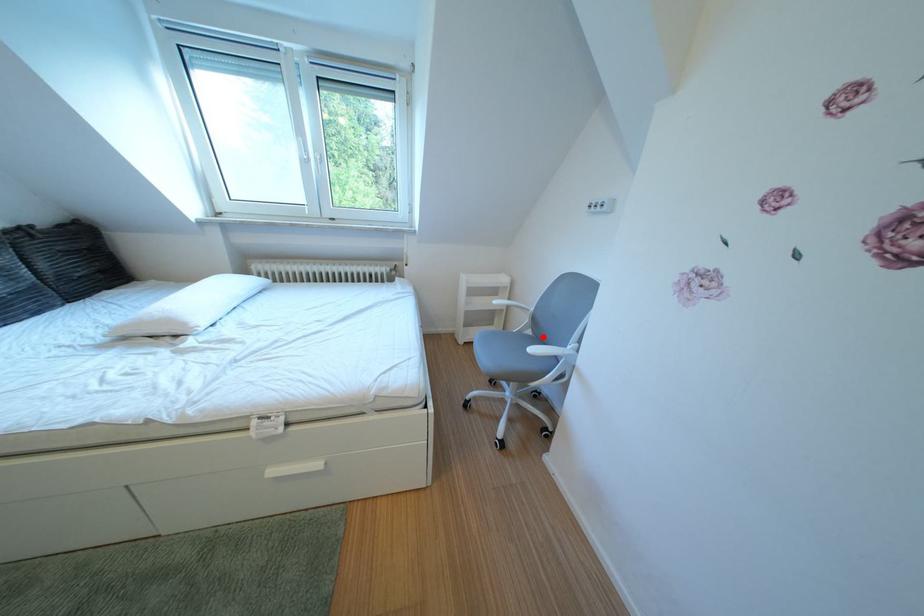
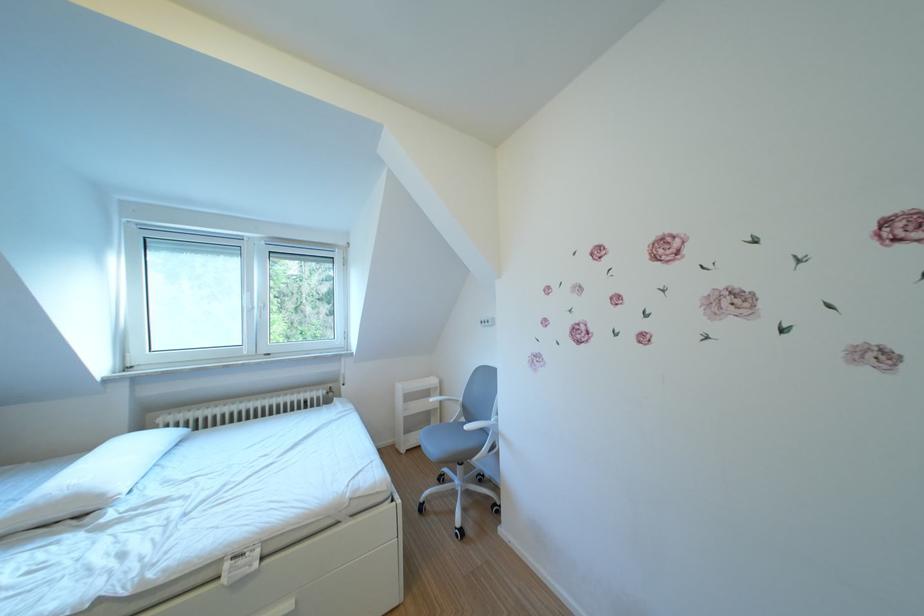
In the second image, find the point that corresponds to the highlighted location in the first image.

(477, 424)